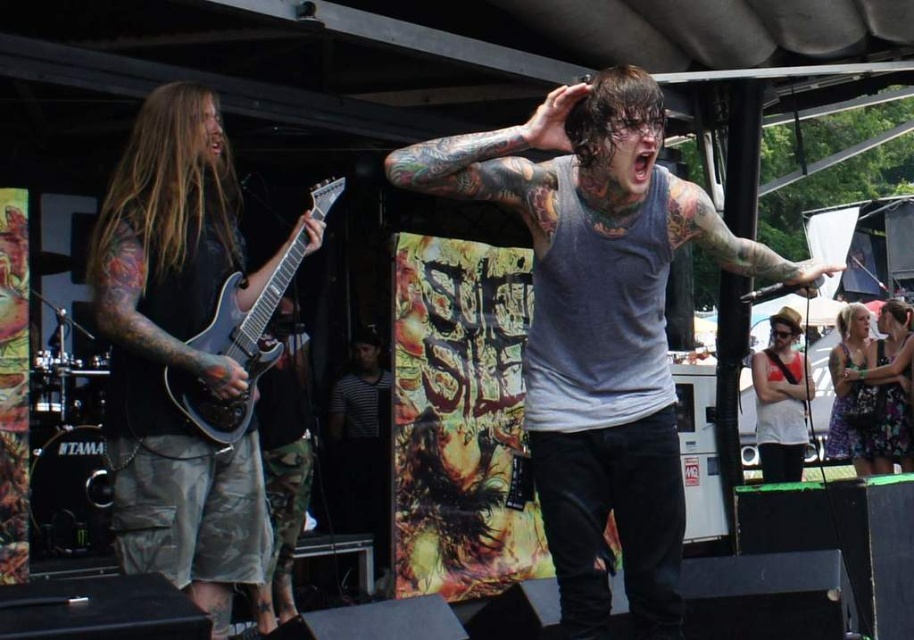
Identify the location of metallic silver electric guitar at left. (236, 349).

Between metallic silver electric guitar at left and floral dress at lower right, which one is positioned higher?

metallic silver electric guitar at left is above.

Measure the distance between point (235, 275) and camera.

Point (235, 275) is 4.68 meters away from camera.

You are a GUI agent. You are given a task and a screenshot of the screen. Output one action in this format:
    pyautogui.click(x=<x>, y=<y>)
    Task: Click on the metallic silver electric guitar at left
    This screenshot has height=640, width=914.
    Given the screenshot: What is the action you would take?
    pyautogui.click(x=236, y=349)

Based on the photo, which is above, gray tank top at center or white tank top at center?

gray tank top at center is above.

Is point (698, 227) positioned in front of point (796, 456)?

Yes.

Find the location of a particular element. The image size is (914, 640). gray tank top at center is located at coordinates (599, 324).

Between matte black guitar at left and floral dress at lower right, which one appears on the right side from the viewer's perspective?

Positioned to the right is floral dress at lower right.

Based on the photo, can you confirm if matte black guitar at left is positioned above floral dress at lower right?

Correct, matte black guitar at left is located above floral dress at lower right.

Does point (181, 124) come closer to viewer compared to point (867, 356)?

That is True.

At what (x,y) coordinates should I click in order to perform the action: click on matte black guitar at left. Please return your answer as a coordinate pair (x, y). The height and width of the screenshot is (640, 914). Looking at the image, I should click on (175, 355).